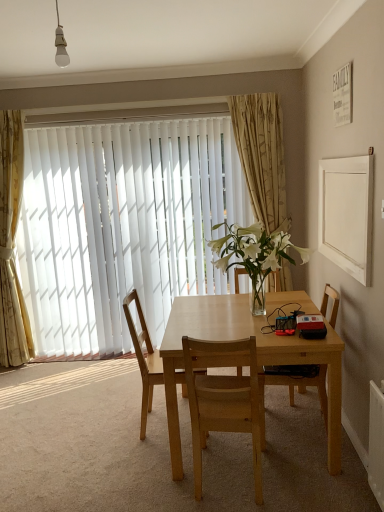
Question: From a real-world perspective, is clear glass vase at center under light brown wood chair at center, the second chair from the left?

Choices:
 (A) yes
 (B) no

Answer: (B)

Question: Is clear glass vase at center to the right of light brown wood chair at center, placed as the 2th chair when sorted from right to left, from the viewer's perspective?

Choices:
 (A) yes
 (B) no

Answer: (A)

Question: Is the depth of clear glass vase at center less than that of light brown wood chair at center, the second chair from the left?

Choices:
 (A) no
 (B) yes

Answer: (A)

Question: Is clear glass vase at center completely or partially outside of light brown wood chair at center, placed as the 2th chair when sorted from right to left?

Choices:
 (A) yes
 (B) no

Answer: (A)

Question: Can you confirm if clear glass vase at center is wider than light brown wood chair at center, the second chair from the left?

Choices:
 (A) yes
 (B) no

Answer: (A)

Question: Based on their positions, is white vertical blinds at center located to the left or right of light brown wood chair at center, placed as the 2th chair when sorted from right to left?

Choices:
 (A) left
 (B) right

Answer: (A)

Question: Considering the positions of white vertical blinds at center and light brown wood chair at center, the second chair from the left, in the image, is white vertical blinds at center taller or shorter than light brown wood chair at center, the second chair from the left,?

Choices:
 (A) short
 (B) tall

Answer: (B)

Question: Looking at the image, does white vertical blinds at center seem bigger or smaller compared to light brown wood chair at center, the second chair from the left?

Choices:
 (A) big
 (B) small

Answer: (A)

Question: Is point (148, 278) closer or farther from the camera than point (195, 394)?

Choices:
 (A) farther
 (B) closer

Answer: (A)

Question: Is point (279, 361) closer or farther from the camera than point (230, 254)?

Choices:
 (A) closer
 (B) farther

Answer: (A)

Question: Would you say light wood table at center is inside or outside clear glass vase at center?

Choices:
 (A) outside
 (B) inside

Answer: (A)

Question: Looking at their shapes, would you say light wood table at center is wider or thinner than clear glass vase at center?

Choices:
 (A) wide
 (B) thin

Answer: (A)

Question: Is light wood table at center taller or shorter than clear glass vase at center?

Choices:
 (A) tall
 (B) short

Answer: (A)

Question: From the image's perspective, is beige floral fabric curtain at upper center, marked as the first curtain in a right-to-left arrangement, located above or below gold textured curtain at left, which is the first curtain in left-to-right order?

Choices:
 (A) above
 (B) below

Answer: (A)

Question: Considering the positions of point (243, 106) and point (19, 112), is point (243, 106) closer or farther from the camera than point (19, 112)?

Choices:
 (A) farther
 (B) closer

Answer: (B)